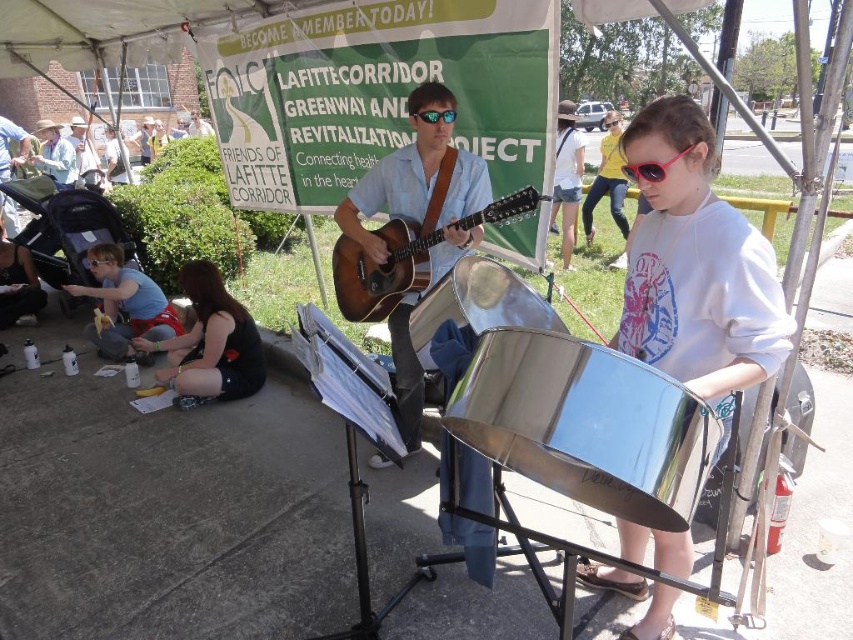
Question: Which object is closer to the camera taking this photo?

Choices:
 (A) clear plastic goggles at lower left
 (B) sunglasses at center
 (C) black fabric shirt at lower left

Answer: (C)

Question: Is the position of shiny metallic drum at center more distant than that of matte blue shirt at lower left?

Choices:
 (A) no
 (B) yes

Answer: (A)

Question: Can you confirm if matte white shirt at center is wider than yellow t-shirt at center?

Choices:
 (A) no
 (B) yes

Answer: (A)

Question: Can you confirm if silver metallic steel drum at center is smaller than yellow t-shirt at center?

Choices:
 (A) no
 (B) yes

Answer: (B)

Question: Which object is the closest to the clear plastic goggles at lower left?

Choices:
 (A) polished stainless steel steelpan at center
 (B) sunglasses at center
 (C) matte blue shirt at lower left
 (D) yellow t-shirt at center

Answer: (C)

Question: Which point appears farthest from the camera in this image?

Choices:
 (A) (618, 131)
 (B) (445, 116)
 (C) (482, 195)

Answer: (A)